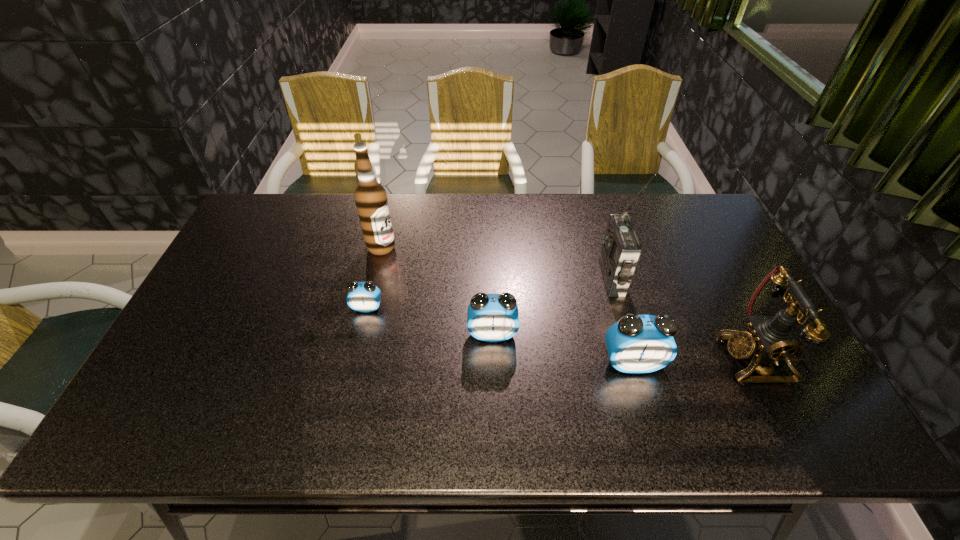
You are a GUI agent. You are given a task and a screenshot of the screen. Output one action in this format:
    pyautogui.click(x=<x>, y=<y>)
    Task: Click on the vacant point located between the radio receiver and the second tallest alarm clock
    
    Given the screenshot: What is the action you would take?
    pyautogui.click(x=552, y=306)

Where is `free spot between the alcohol and the shortest object`? Image resolution: width=960 pixels, height=540 pixels. free spot between the alcohol and the shortest object is located at coordinates (374, 278).

Where is `free spot between the fifth nearest object and the shortest object`? free spot between the fifth nearest object and the shortest object is located at coordinates (490, 293).

You are a GUI agent. You are given a task and a screenshot of the screen. Output one action in this format:
    pyautogui.click(x=<x>, y=<y>)
    Task: Click on the empty space that is in between the radio receiver and the farthest object
    The image size is (960, 540).
    Given the screenshot: What is the action you would take?
    pyautogui.click(x=497, y=263)

Identify which object is the nearest to the nearest alarm clock. Please provide its 2D coordinates. Your answer should be formatted as a tuple, i.e. [(x, y)], where the tuple contains the x and y coordinates of a point satisfying the conditions above.

[(769, 338)]

I want to click on object identified as the second closest to the rightmost object, so click(621, 249).

Select which alarm clock appears as the third closest to the fourth shortest object. Please provide its 2D coordinates. Your answer should be formatted as a tuple, i.e. [(x, y)], where the tuple contains the x and y coordinates of a point satisfying the conditions above.

[(364, 297)]

Locate which alarm clock ranks second in proximity to the shortest alarm clock. Please provide its 2D coordinates. Your answer should be formatted as a tuple, i.e. [(x, y)], where the tuple contains the x and y coordinates of a point satisfying the conditions above.

[(637, 344)]

Identify the location of vacant area that satisfies the following two spatial constraints: 1. on the label of the farthest object; 2. on the face of the farthest alarm clock. This screenshot has height=540, width=960. (368, 308).

At what (x,y) coordinates should I click in order to perform the action: click on vacant space that satisfies the following two spatial constraints: 1. on the front of the third tallest object, featuring the rotary dial; 2. on the face of the rightmost alarm clock. Please return your answer as a coordinate pair (x, y). The height and width of the screenshot is (540, 960). Looking at the image, I should click on pos(756,363).